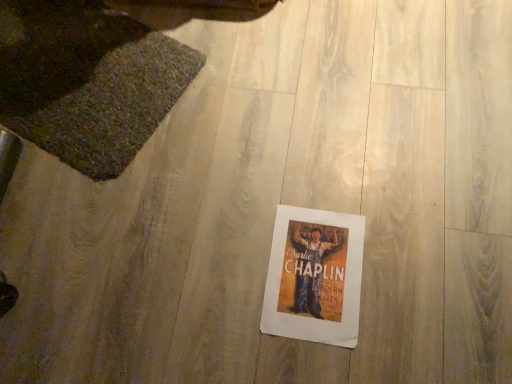
Question: From a real-world perspective, is white paper poster at center under textured woolen mat at upper left?

Choices:
 (A) yes
 (B) no

Answer: (A)

Question: Would you say white paper poster at center contains textured woolen mat at upper left?

Choices:
 (A) yes
 (B) no

Answer: (B)

Question: Are white paper poster at center and textured woolen mat at upper left beside each other?

Choices:
 (A) no
 (B) yes

Answer: (A)

Question: From the image's perspective, would you say white paper poster at center is positioned over textured woolen mat at upper left?

Choices:
 (A) yes
 (B) no

Answer: (B)

Question: Is white paper poster at center turned away from textured woolen mat at upper left?

Choices:
 (A) no
 (B) yes

Answer: (A)

Question: Does white paper poster at center have a lesser width compared to textured woolen mat at upper left?

Choices:
 (A) yes
 (B) no

Answer: (A)

Question: Are textured woolen mat at upper left and white paper poster at center far apart?

Choices:
 (A) no
 (B) yes

Answer: (A)

Question: Is textured woolen mat at upper left further to camera compared to white paper poster at center?

Choices:
 (A) no
 (B) yes

Answer: (B)

Question: Does textured woolen mat at upper left have a larger size compared to white paper poster at center?

Choices:
 (A) yes
 (B) no

Answer: (A)

Question: Does textured woolen mat at upper left contain white paper poster at center?

Choices:
 (A) yes
 (B) no

Answer: (B)

Question: Is textured woolen mat at upper left in front of white paper poster at center?

Choices:
 (A) yes
 (B) no

Answer: (B)

Question: Can you confirm if textured woolen mat at upper left is thinner than white paper poster at center?

Choices:
 (A) no
 (B) yes

Answer: (A)

Question: Is point [x=280, y=236] closer or farther from the camera than point [x=146, y=102]?

Choices:
 (A) farther
 (B) closer

Answer: (B)